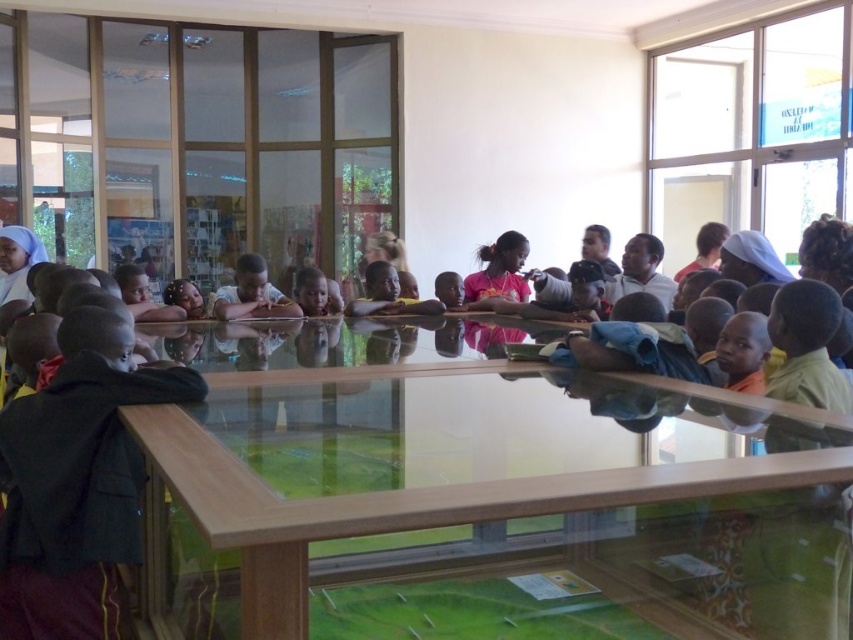
Is dark brown fabric jacket at left to the right of matte skin child at center from the viewer's perspective?

No, dark brown fabric jacket at left is not to the right of matte skin child at center.

Is dark brown fabric jacket at left shorter than matte skin child at center?

In fact, dark brown fabric jacket at left may be taller than matte skin child at center.

Is point (0, 538) positioned before point (320, 285)?

That is True.

At what (x,y) coordinates should I click in order to perform the action: click on dark brown fabric jacket at left. Please return your answer as a coordinate pair (x, y). Looking at the image, I should click on (76, 483).

Is transparent glass table at center above matte skin child at center?

Actually, transparent glass table at center is below matte skin child at center.

Who is more distant from viewer, [173,541] or [328,296]?

The point [328,296] is more distant.

Locate an element on the screen. The image size is (853, 640). transparent glass table at center is located at coordinates (479, 499).

Can you confirm if transparent glass table at center is positioned to the left of dark brown fabric jacket at left?

Incorrect, transparent glass table at center is not on the left side of dark brown fabric jacket at left.

Which is behind, point (604, 541) or point (67, 403)?

The point (67, 403) is behind.

Where is `transparent glass table at center`? The height and width of the screenshot is (640, 853). transparent glass table at center is located at coordinates (479, 499).